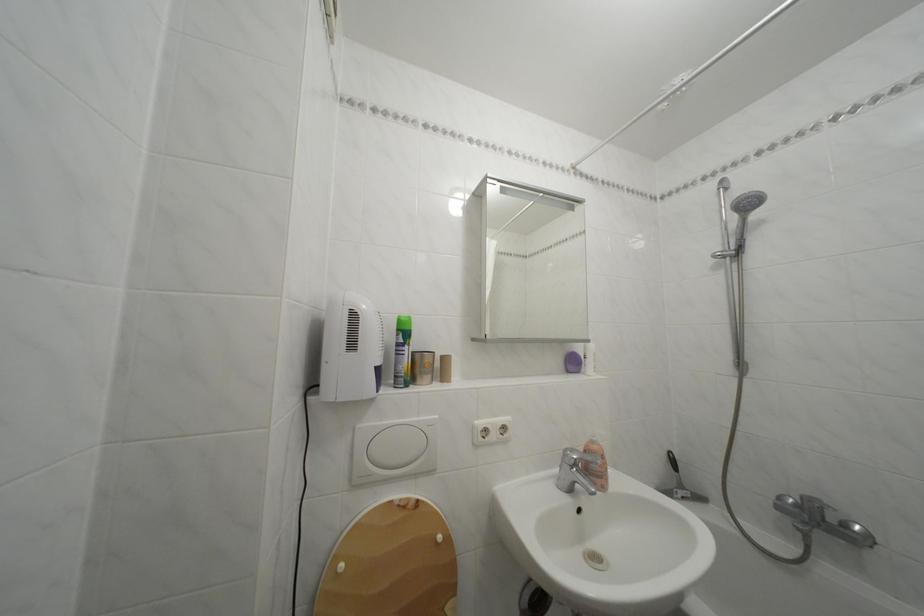
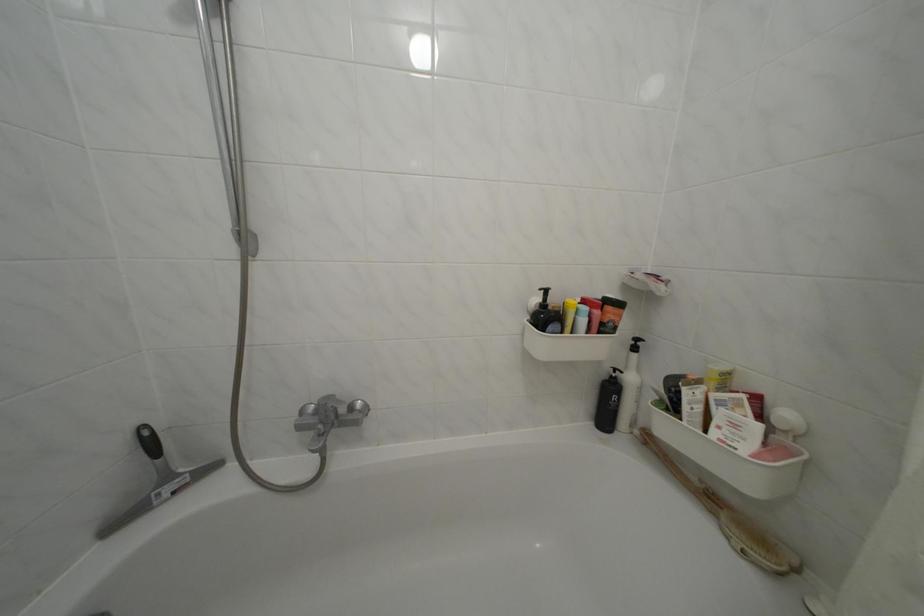
Where in the second image is the point corresponding to pixel 689 492 from the first image?

(176, 484)